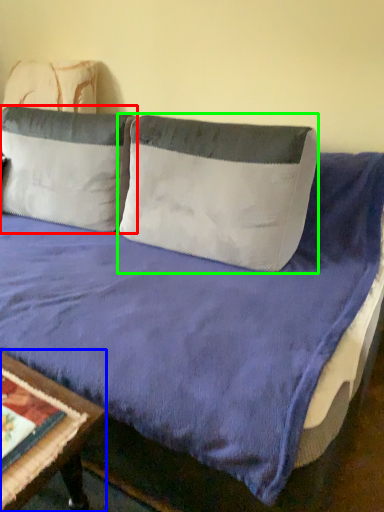
Question: Based on their relative distances, which object is farther from pillow (highlighted by a red box)? Choose from table (highlighted by a blue box) and pillow (highlighted by a green box).

Choices:
 (A) table
 (B) pillow

Answer: (A)